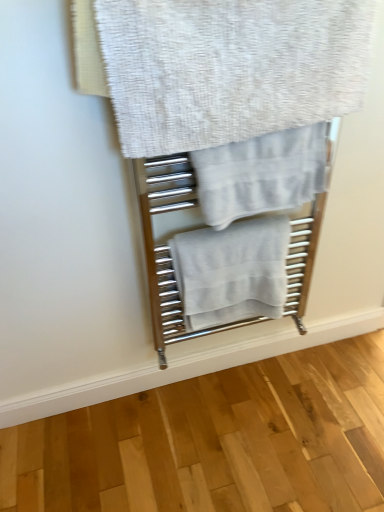
Question: Looking at their shapes, would you say white cotton towel at center, which is the 1th towel in bottom-to-top order, is wider or thinner than white textured towel at upper center, acting as the first towel starting from the top?

Choices:
 (A) thin
 (B) wide

Answer: (B)

Question: From the image's perspective, is white cotton towel at center, the 3th towel in the top-to-bottom sequence, above or below white textured towel at upper center, marked as the third towel in a bottom-to-top arrangement?

Choices:
 (A) below
 (B) above

Answer: (A)

Question: Which of these objects is positioned closest to the light gray cotton towel at center, which ranks as the second towel in top-to-bottom order?

Choices:
 (A) white cotton towel at center, the 3th towel in the top-to-bottom sequence
 (B) white textured towel at upper center, acting as the first towel starting from the top

Answer: (B)

Question: Which of these objects is positioned farthest from the light gray cotton towel at center, which ranks as the second towel in top-to-bottom order?

Choices:
 (A) white cotton towel at center, which is the 1th towel in bottom-to-top order
 (B) white textured towel at upper center, marked as the third towel in a bottom-to-top arrangement

Answer: (A)